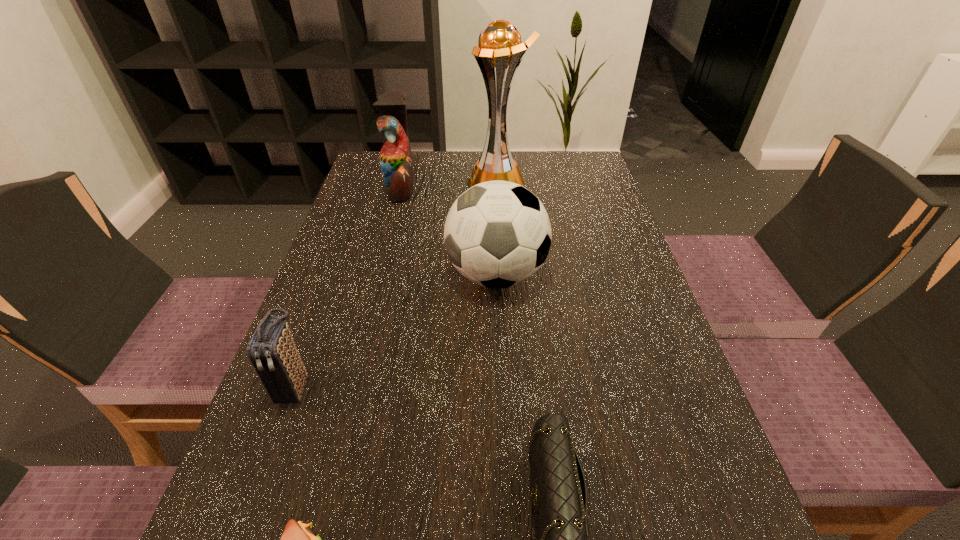
You are a GUI agent. You are given a task and a screenshot of the screen. Output one action in this format:
    pyautogui.click(x=<x>, y=<y>)
    Task: Click on the vacant position at the right edge of the desktop
    This screenshot has height=540, width=960.
    Given the screenshot: What is the action you would take?
    pyautogui.click(x=682, y=481)

The image size is (960, 540). Find the location of `free space at the far right corner`. free space at the far right corner is located at coordinates (555, 181).

Find the location of `free spot between the farther clutch bag and the parrot`. free spot between the farther clutch bag and the parrot is located at coordinates pos(348,287).

Find the location of a particular element. Image resolution: width=960 pixels, height=540 pixels. vacant area that lies between the taller clutch bag and the third farthest object is located at coordinates (396, 331).

Image resolution: width=960 pixels, height=540 pixels. I want to click on object identified as the third closest to the sandwich, so click(497, 234).

Identify the location of object that is the third closest to the leftmost object. The height and width of the screenshot is (540, 960). (559, 492).

Where is `free location that satisfies the following two spatial constraints: 1. at the face of the parrot; 2. with the zip open on the leftmost object`? free location that satisfies the following two spatial constraints: 1. at the face of the parrot; 2. with the zip open on the leftmost object is located at coordinates (349, 387).

Locate an element on the screen. The width and height of the screenshot is (960, 540). vacant space that satisfies the following two spatial constraints: 1. on the main logo of the soccer ball; 2. with the zip open on the taller clutch bag is located at coordinates (501, 387).

At what (x,y) coordinates should I click in order to perform the action: click on vacant area in the image that satisfies the following two spatial constraints: 1. on the main logo of the third farthest object; 2. with the zip open on the leftmost object. Please return your answer as a coordinate pair (x, y). This screenshot has width=960, height=540. Looking at the image, I should click on (501, 387).

At what (x,y) coordinates should I click in order to perform the action: click on vacant area that satisfies the following two spatial constraints: 1. on the front-facing side of the trophy; 2. with the zip open on the third shortest object. Please return your answer as a coordinate pair (x, y). The height and width of the screenshot is (540, 960). Looking at the image, I should click on (510, 387).